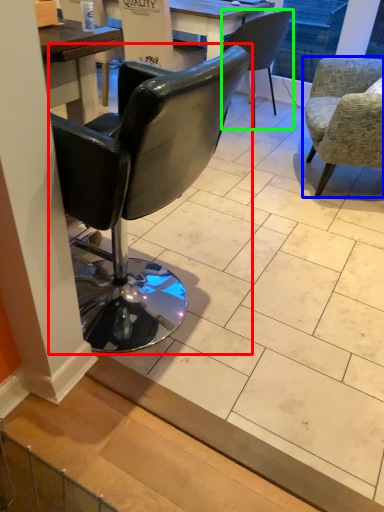
Question: Which object is the farthest from chair (highlighted by a red box)? Choose among these: chair (highlighted by a blue box) or chair (highlighted by a green box).

Choices:
 (A) chair
 (B) chair

Answer: (B)